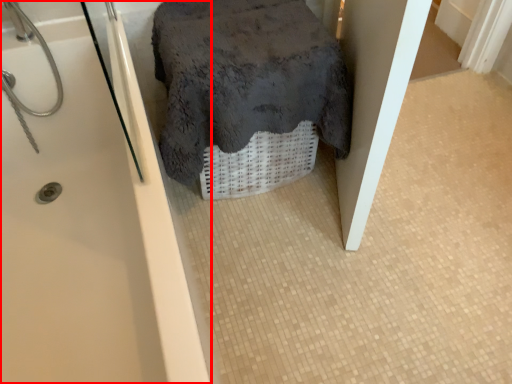
Question: In this image, where is bathtub (annotated by the red box) located relative to bath towel?

Choices:
 (A) left
 (B) right

Answer: (A)